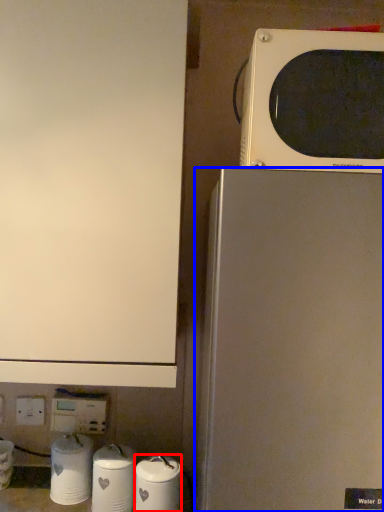
Question: Which point is further to the camera, appliance (highlighted by a red box) or refrigerator (highlighted by a blue box)?

Choices:
 (A) appliance
 (B) refrigerator

Answer: (A)